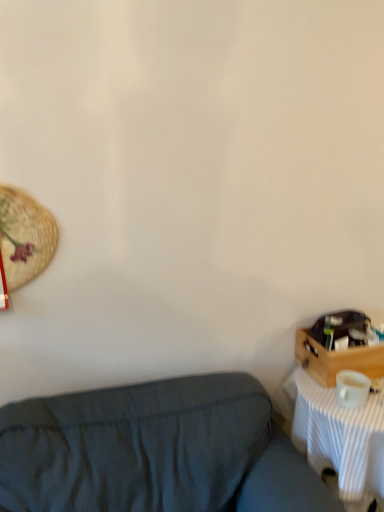
Identify the location of vacant area that lies in front of white matte coffee cup at right. (360, 417).